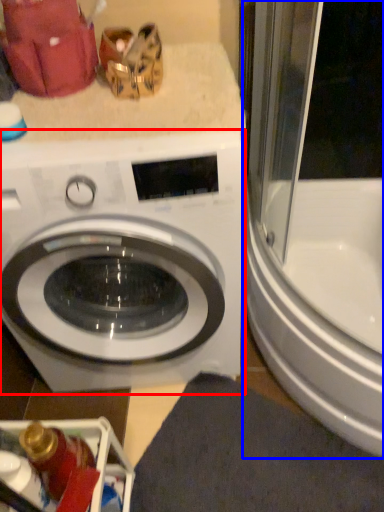
Question: Which point is further to the camera, washing machine (highlighted by a red box) or screen door (highlighted by a blue box)?

Choices:
 (A) washing machine
 (B) screen door

Answer: (B)